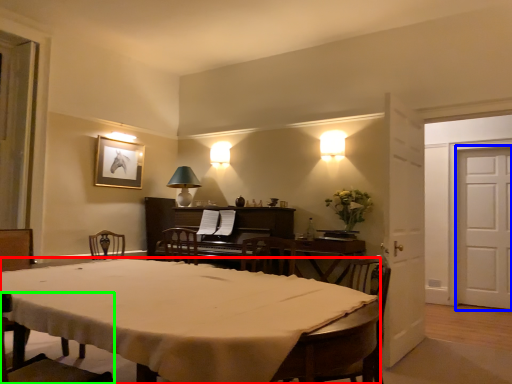
Question: Which is farther away from desk (highlighted by a red box)? door (highlighted by a blue box) or chair (highlighted by a green box)?

Choices:
 (A) door
 (B) chair

Answer: (A)